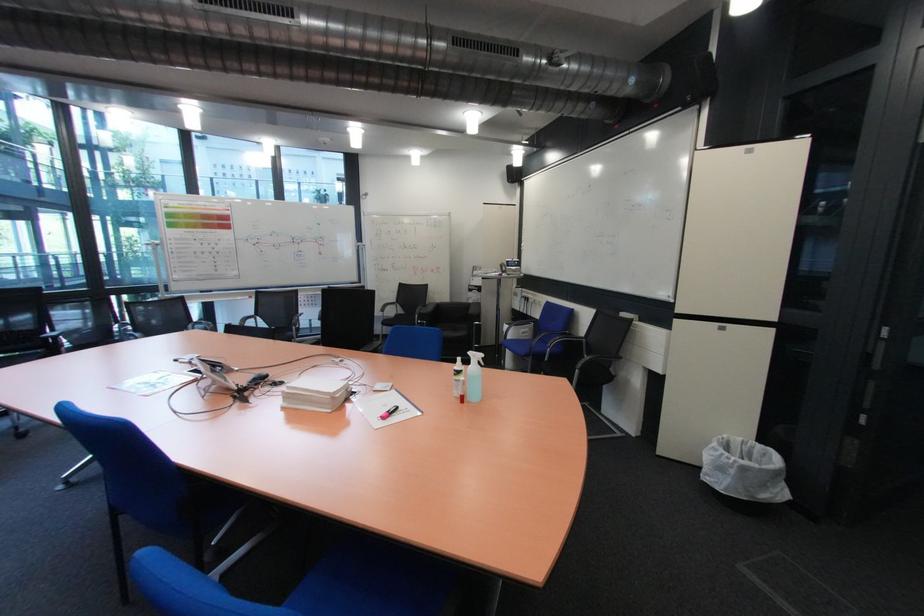
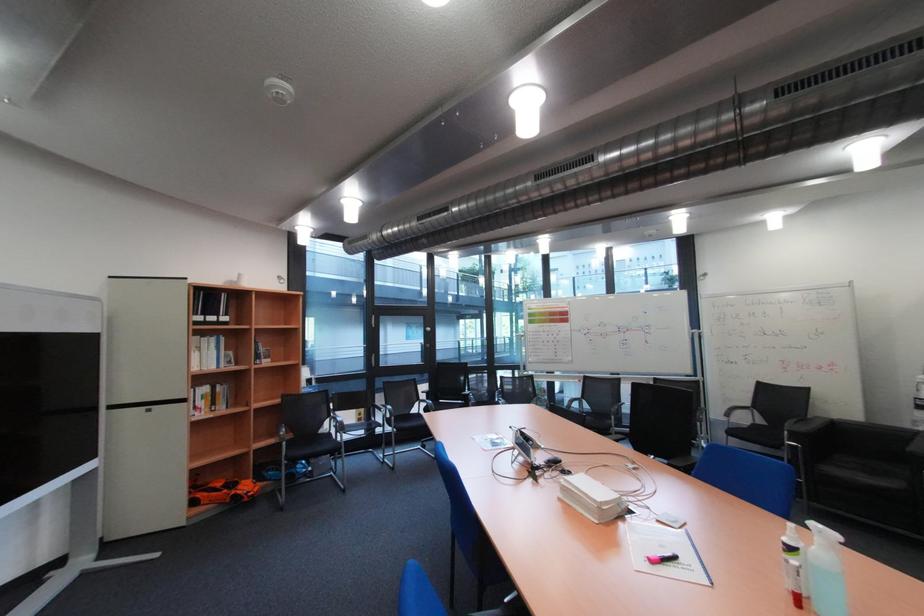
Question: The camera is either moving clockwise (left) or counter-clockwise (right) around the object. The first image is from the beginning of the video and the second image is from the end. Is the camera moving left or right when shooting the video?

Choices:
 (A) Left
 (B) Right

Answer: (B)